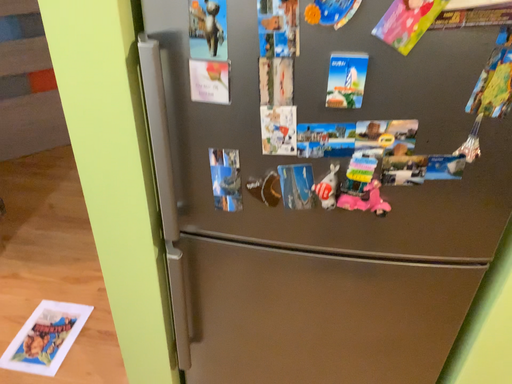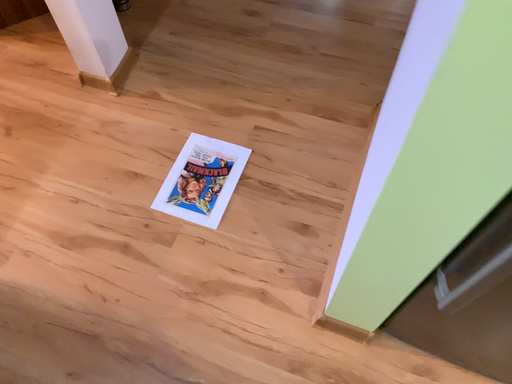
Question: How did the camera likely rotate when shooting the video?

Choices:
 (A) rotated downward
 (B) rotated upward

Answer: (A)